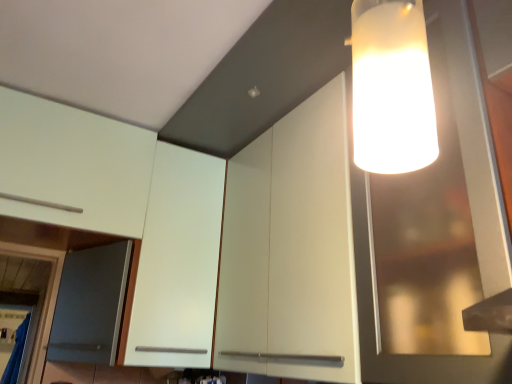
Question: Considering the relative sizes of white matte cabinet at upper left, which ranks as the first cabinetry in left-to-right order, and white matte cabinet at upper left, arranged as the 2th cabinetry when viewed from the left, in the image provided, is white matte cabinet at upper left, which ranks as the first cabinetry in left-to-right order, wider than white matte cabinet at upper left, arranged as the 2th cabinetry when viewed from the left,?

Choices:
 (A) no
 (B) yes

Answer: (B)

Question: Is white matte cabinet at upper left, which is counted as the third cabinetry, starting from the right, far away from white matte cabinet at upper left, marked as the second cabinetry in a right-to-left arrangement?

Choices:
 (A) yes
 (B) no

Answer: (B)

Question: Considering the relative positions of white matte cabinet at upper left, which is counted as the third cabinetry, starting from the right, and white matte cabinet at upper left, marked as the second cabinetry in a right-to-left arrangement, in the image provided, is white matte cabinet at upper left, which is counted as the third cabinetry, starting from the right, to the left of white matte cabinet at upper left, marked as the second cabinetry in a right-to-left arrangement, from the viewer's perspective?

Choices:
 (A) no
 (B) yes

Answer: (B)

Question: Is white matte cabinet at upper left, which is counted as the third cabinetry, starting from the right, beside white matte cabinet at upper left, marked as the second cabinetry in a right-to-left arrangement?

Choices:
 (A) no
 (B) yes

Answer: (A)

Question: Is white matte cabinet at upper left, which is counted as the third cabinetry, starting from the right, at the right side of white matte cabinet at upper left, marked as the second cabinetry in a right-to-left arrangement?

Choices:
 (A) no
 (B) yes

Answer: (A)

Question: From a real-world perspective, is white matte cabinet at upper left, which is counted as the third cabinetry, starting from the right, physically below white matte cabinet at upper left, arranged as the 2th cabinetry when viewed from the left?

Choices:
 (A) yes
 (B) no

Answer: (B)

Question: From a real-world perspective, is white matte cabinet at upper right, placed as the third cabinetry when sorted from left to right, positioned over transparent glass cabinet at upper right based on gravity?

Choices:
 (A) no
 (B) yes

Answer: (A)

Question: Considering the relative positions of white matte cabinet at upper right, arranged as the 1th cabinetry when viewed from the right, and transparent glass cabinet at upper right in the image provided, is white matte cabinet at upper right, arranged as the 1th cabinetry when viewed from the right, to the left of transparent glass cabinet at upper right from the viewer's perspective?

Choices:
 (A) yes
 (B) no

Answer: (A)

Question: Is transparent glass cabinet at upper right completely or partially inside white matte cabinet at upper right, placed as the third cabinetry when sorted from left to right?

Choices:
 (A) no
 (B) yes

Answer: (B)

Question: Is white matte cabinet at upper right, arranged as the 1th cabinetry when viewed from the right, smaller than transparent glass cabinet at upper right?

Choices:
 (A) yes
 (B) no

Answer: (A)

Question: Is white matte cabinet at upper right, arranged as the 1th cabinetry when viewed from the right, wider than transparent glass cabinet at upper right?

Choices:
 (A) yes
 (B) no

Answer: (B)

Question: Is white matte cabinet at upper right, placed as the third cabinetry when sorted from left to right, taller than transparent glass cabinet at upper right?

Choices:
 (A) yes
 (B) no

Answer: (B)

Question: Is white matte cabinet at upper left, which ranks as the first cabinetry in left-to-right order, aimed at white matte cabinet at upper right, arranged as the 1th cabinetry when viewed from the right?

Choices:
 (A) no
 (B) yes

Answer: (A)